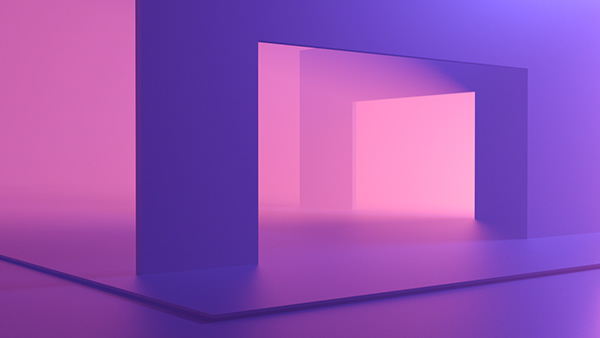
The width and height of the screenshot is (600, 338). I want to click on floor, so click(x=232, y=308).